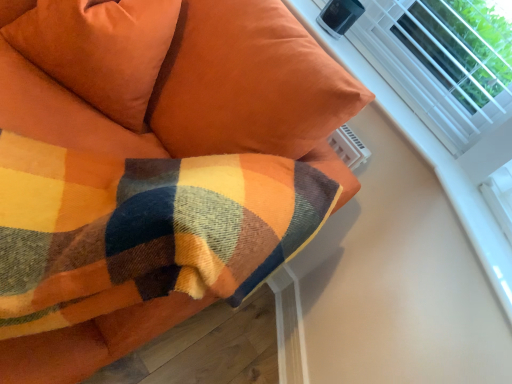
Question: From their relative heights in the image, would you say plaid wool blanket at upper left is taller or shorter than suede-like orange pillow at upper left?

Choices:
 (A) short
 (B) tall

Answer: (B)

Question: In the image, is plaid wool blanket at upper left positioned in front of or behind suede-like orange pillow at upper left?

Choices:
 (A) behind
 (B) front

Answer: (B)

Question: Which is farther from the suede-like orange pillow at upper left?

Choices:
 (A) plaid wool blanket at upper left
 (B) white plastic radiator at upper right

Answer: (B)

Question: Estimate the real-world distances between objects in this image. Which object is closer to the plaid wool blanket at upper left?

Choices:
 (A) white plastic radiator at upper right
 (B) suede-like orange pillow at upper left

Answer: (B)